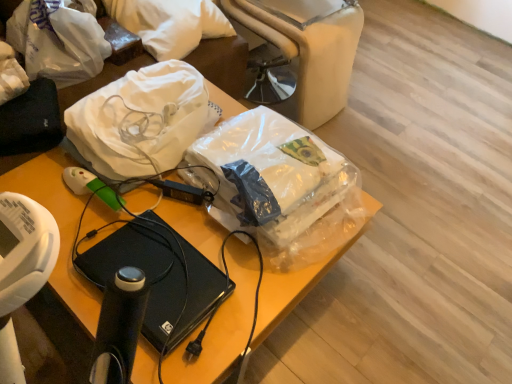
Where is `vacant space that is to the left of black matte laptop at center`? vacant space that is to the left of black matte laptop at center is located at coordinates (81, 248).